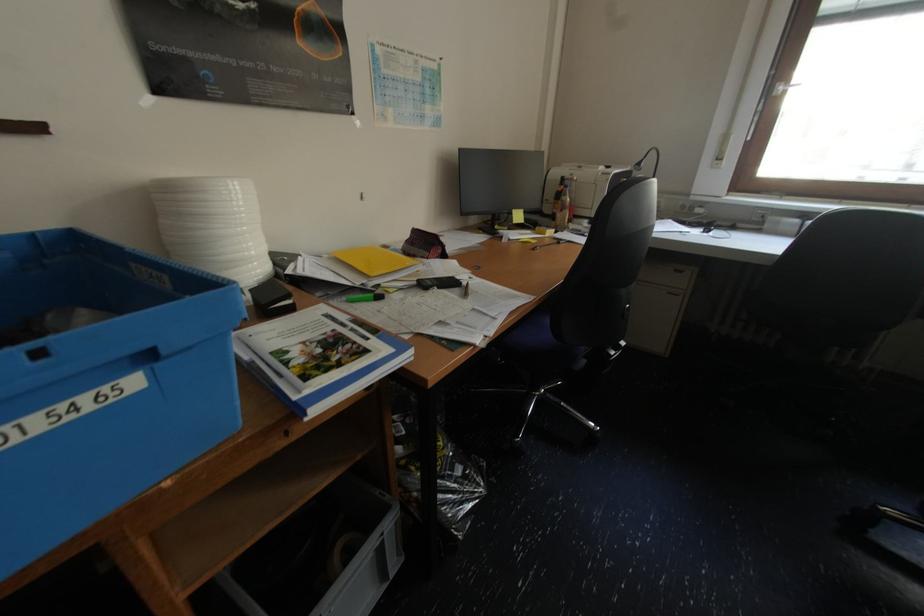
The location [318,357] corresponds to which object?

It refers to a blue and white book.